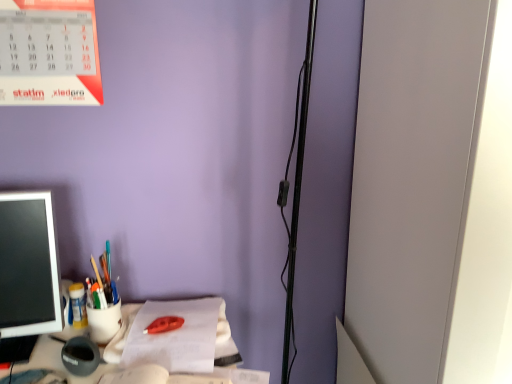
Question: Is white paper at center not within matte plastic cup at left, which ranks as the 2th stationery in front-to-back order?

Choices:
 (A) yes
 (B) no

Answer: (A)

Question: Can you confirm if white paper at center is wider than matte plastic cup at left, which is the third stationery from back to front?

Choices:
 (A) yes
 (B) no

Answer: (A)

Question: Does white paper at center appear on the left side of matte plastic cup at left, which ranks as the 2th stationery in front-to-back order?

Choices:
 (A) no
 (B) yes

Answer: (A)

Question: Are white paper at center and matte plastic cup at left, which is the third stationery from back to front, making contact?

Choices:
 (A) no
 (B) yes

Answer: (A)

Question: From a real-world perspective, is white paper at center on matte plastic cup at left, which is the third stationery from back to front?

Choices:
 (A) yes
 (B) no

Answer: (B)

Question: Is matte plastic pen holder at left, the 2th stationery when ordered from back to front, bigger or smaller than white paper at center?

Choices:
 (A) big
 (B) small

Answer: (B)

Question: Considering the positions of matte plastic pen holder at left, the third stationery when ordered from front to back, and white paper at center in the image, is matte plastic pen holder at left, the third stationery when ordered from front to back, taller or shorter than white paper at center?

Choices:
 (A) short
 (B) tall

Answer: (B)

Question: Is matte plastic pen holder at left, the 2th stationery when ordered from back to front, spatially inside white paper at center, or outside of it?

Choices:
 (A) outside
 (B) inside

Answer: (A)

Question: From a real-world perspective, is matte plastic pen holder at left, the 2th stationery when ordered from back to front, physically located above or below white paper at center?

Choices:
 (A) below
 (B) above

Answer: (B)

Question: From the image's perspective, is matte plastic pen holder at left positioned above or below matte plastic cup at left, which is the third stationery from back to front?

Choices:
 (A) above
 (B) below

Answer: (A)

Question: Is point (27, 210) closer or farther from the camera than point (108, 284)?

Choices:
 (A) closer
 (B) farther

Answer: (A)

Question: In terms of height, does matte plastic pen holder at left look taller or shorter compared to matte plastic cup at left, which is the third stationery from back to front?

Choices:
 (A) tall
 (B) short

Answer: (A)

Question: Would you say matte plastic pen holder at left is inside or outside matte plastic cup at left, which ranks as the 2th stationery in front-to-back order?

Choices:
 (A) outside
 (B) inside

Answer: (A)

Question: Considering the positions of matte plastic cup at left, the fourth stationery when ordered from front to back, and matte plastic pen holder at left in the image, is matte plastic cup at left, the fourth stationery when ordered from front to back, wider or thinner than matte plastic pen holder at left?

Choices:
 (A) thin
 (B) wide

Answer: (A)

Question: Looking at the image, does matte plastic cup at left, placed as the first stationery when sorted from back to front, seem bigger or smaller compared to matte plastic pen holder at left?

Choices:
 (A) small
 (B) big

Answer: (A)